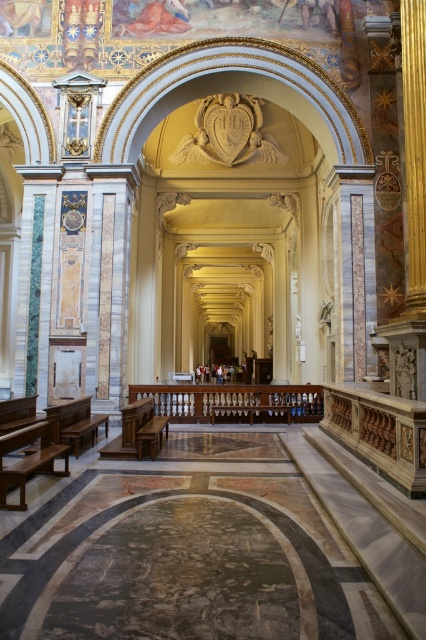
Question: Estimate the real-world distances between objects in this image. Which object is farther from the brown polished wood bench at lower left?

Choices:
 (A) polished wood bench at center
 (B) wooden bench at lower left

Answer: (A)

Question: Does wooden bench at lower left appear under brown polished wood bench at lower left?

Choices:
 (A) yes
 (B) no

Answer: (B)

Question: Which object is the farthest from the polished wood bench at center?

Choices:
 (A) wooden bench at lower left
 (B) brown polished wood bench at lower left

Answer: (A)

Question: Which object appears closest to the camera in this image?

Choices:
 (A) brown polished wood bench at lower left
 (B) polished wood bench at center
 (C) wooden bench at lower left

Answer: (C)

Question: Can you confirm if polished wood bench at center is thinner than brown polished wood bench at lower left?

Choices:
 (A) yes
 (B) no

Answer: (B)

Question: Can you confirm if wooden bench at lower left is wider than polished wood bench at center?

Choices:
 (A) no
 (B) yes

Answer: (A)